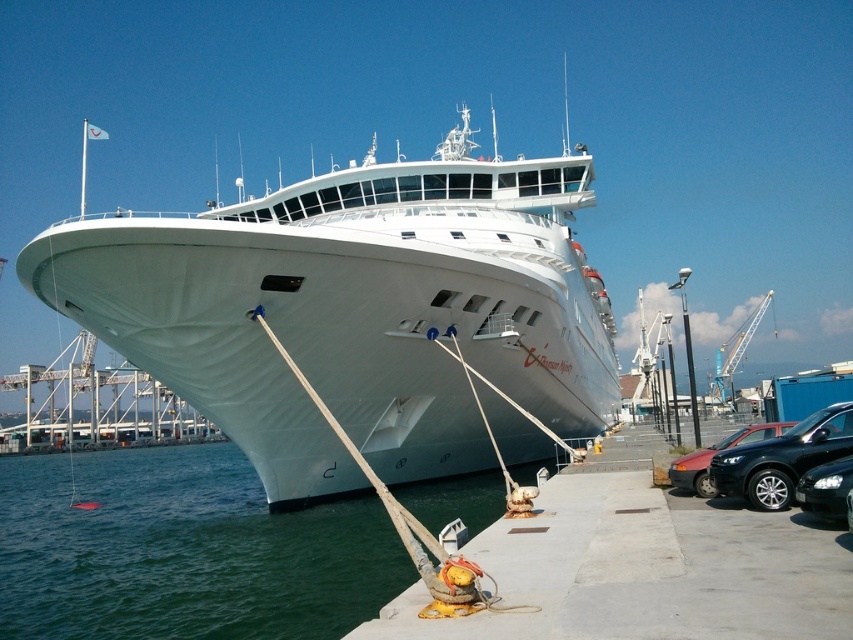
You are standing on the pier looking at the cruise ship. There are two points marked on the ship. One is at coordinate point (x=671, y=484) and the other is at point (x=799, y=496). Which point is closer to you?

Point (x=671, y=484) is further to the camera than point (x=799, y=496), so the point closer to you is point (x=799, y=496).

You are standing on the pier and want to walk from the green water at lower left to the black glossy sedan at lower right. Which direction should you move to get closer to the sedan?

The green water at lower left is further to the viewer than the black glossy sedan at lower right, so to move closer to the sedan, you should walk away from the water towards the direction of the sedan.

You are a photographer planning to capture the cruise ship from the pier. You notice the green water at lower left and the matte black car at lower right in your shot. Which object takes up more space in the image?

The green water at lower left takes up more space in the image because it is larger in size than the matte black car at lower right.